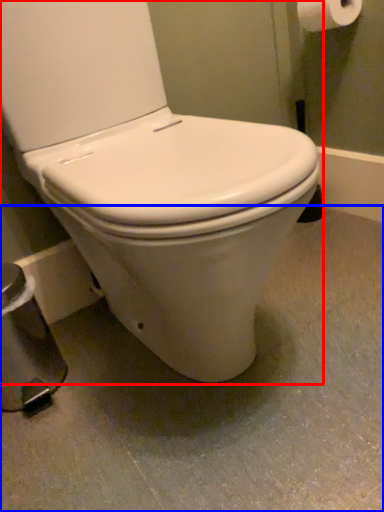
Question: Which of the following is the farthest to the observer, toilet (highlighted by a red box) or concrete (highlighted by a blue box)?

Choices:
 (A) toilet
 (B) concrete

Answer: (B)